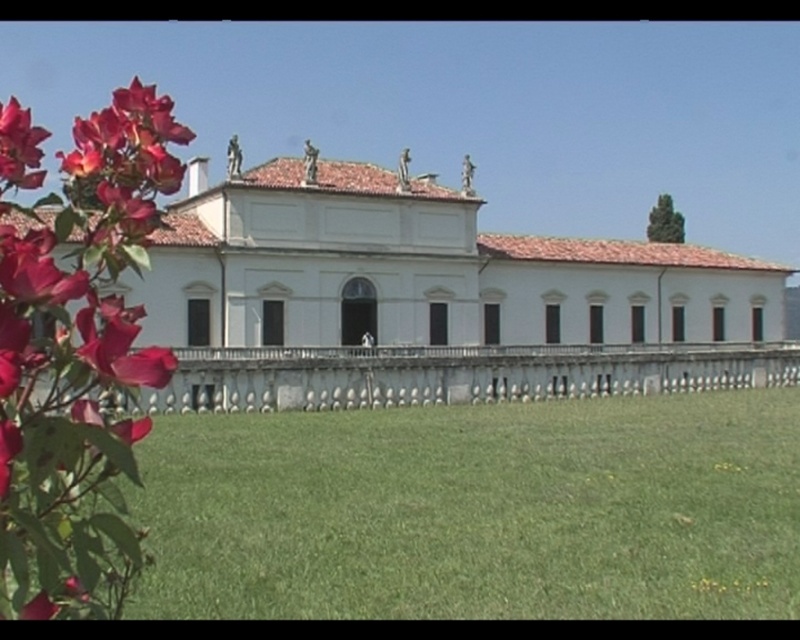
Does white smooth palace at center appear on the left side of matte red petals at left?

In fact, white smooth palace at center is to the right of matte red petals at left.

Can you confirm if white smooth palace at center is thinner than matte red petals at left?

Incorrect, white smooth palace at center's width is not less than matte red petals at left's.

Which is in front, point (202, 182) or point (158, 372)?

Positioned in front is point (158, 372).

Identify the location of white smooth palace at center. Image resolution: width=800 pixels, height=640 pixels. (428, 292).

The image size is (800, 640). Describe the element at coordinates (428, 292) in the screenshot. I see `white smooth palace at center` at that location.

Looking at this image, who is shorter, white smooth palace at center or white stone fence at center?

white stone fence at center is shorter.

Which is behind, point (482, 294) or point (248, 369)?

Point (482, 294)

Identify the location of white smooth palace at center. (428, 292).

Consider the image. Is matte red petals at left thinner than white stone fence at center?

Yes.

Is the position of matte red petals at left more distant than that of white stone fence at center?

No, it is not.

Between point (20, 173) and point (617, 346), which one is positioned behind?

Positioned behind is point (617, 346).

The height and width of the screenshot is (640, 800). Identify the location of matte red petals at left. (80, 365).